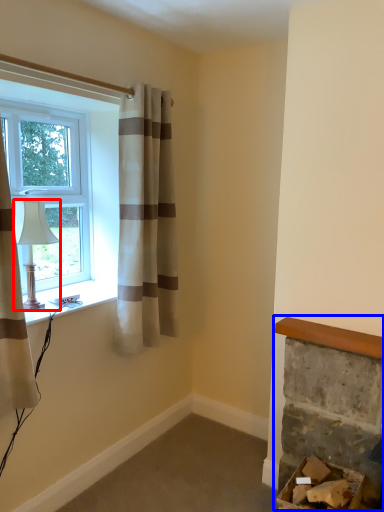
Question: Which point is closer to the camera, lamp (highlighted by a red box) or fireplace (highlighted by a blue box)?

Choices:
 (A) lamp
 (B) fireplace

Answer: (B)